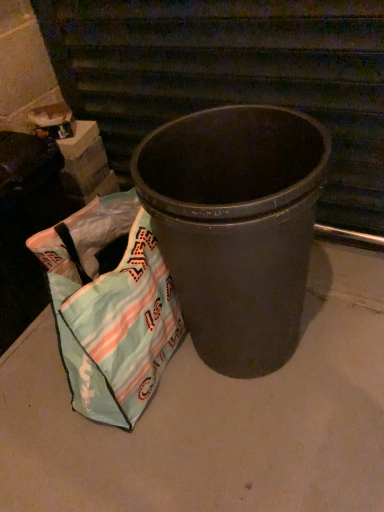
Question: Relative to matte black trash can at center, is matte gray concrete at center in front or behind?

Choices:
 (A) behind
 (B) front

Answer: (A)

Question: Is point (180, 501) positioned closer to the camera than point (296, 174)?

Choices:
 (A) farther
 (B) closer

Answer: (B)

Question: Based on their relative distances, which object is farther from the textured fabric bag at lower left?

Choices:
 (A) matte gray concrete at center
 (B) matte black trash can at center

Answer: (A)

Question: Estimate the real-world distances between objects in this image. Which object is closer to the matte black trash can at center?

Choices:
 (A) textured fabric bag at lower left
 (B) matte gray concrete at center

Answer: (A)